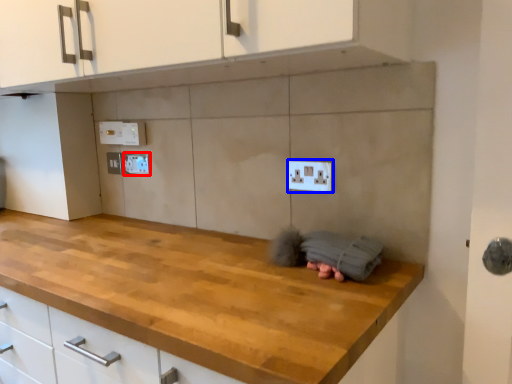
Question: Which point is closer to the camera, electric outlet (highlighted by a red box) or electric outlet (highlighted by a blue box)?

Choices:
 (A) electric outlet
 (B) electric outlet

Answer: (B)